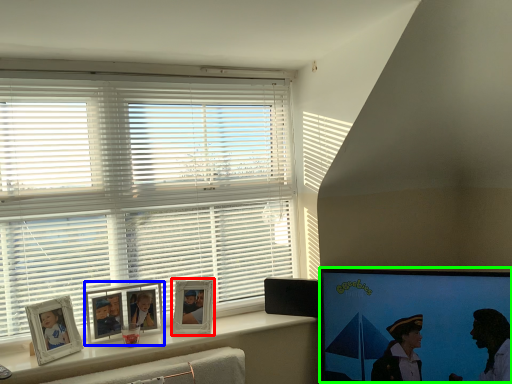
Question: Which is farther away from picture frame (highlighted by a red box)? picture frame (highlighted by a blue box) or computer monitor (highlighted by a green box)?

Choices:
 (A) picture frame
 (B) computer monitor

Answer: (B)